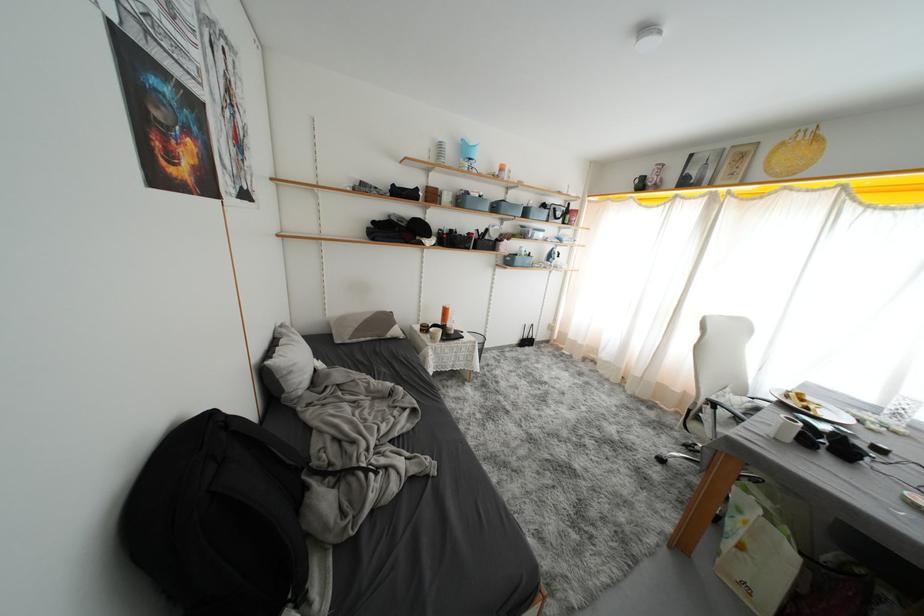
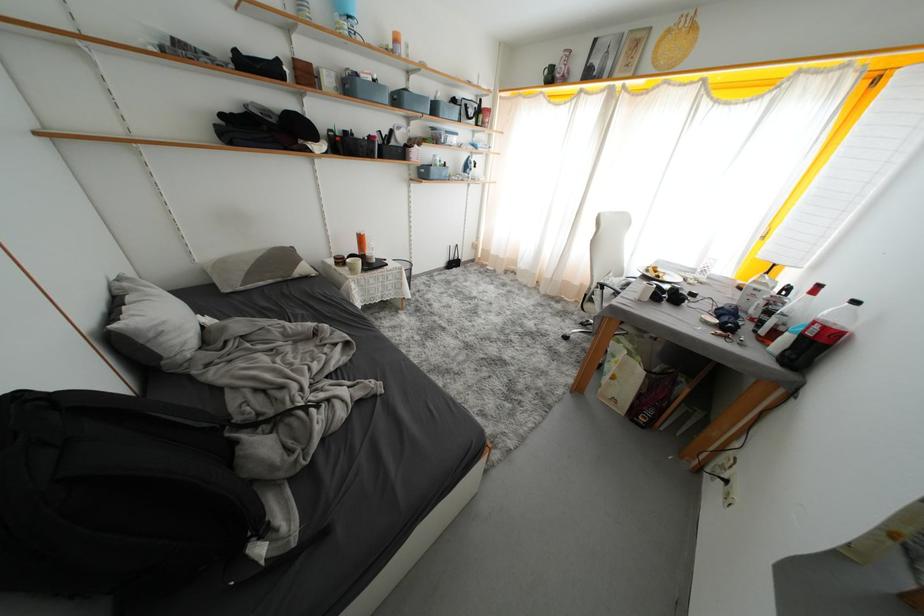
In the second image, find the point that corresponds to (x=516, y=265) in the first image.

(431, 177)